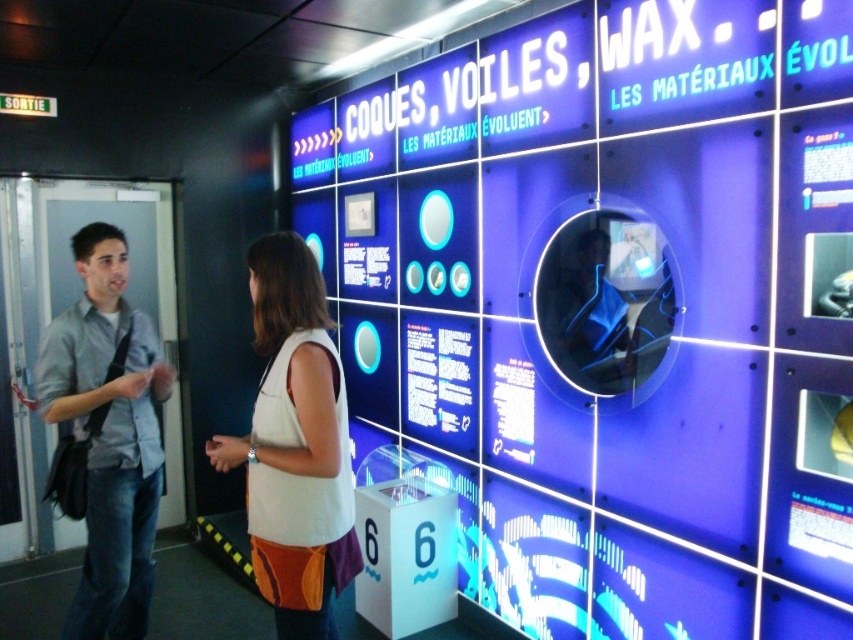
You are standing in front of the exhibit and see the white fabric dress at center and the light blue shirt at left. Which clothing item is positioned more to the right side of the exhibit?

The white fabric dress at center is positioned more to the right side of the exhibit than the light blue shirt at left.

You are standing in front of the interactive exhibit and notice two points marked on the wall. The first point is at coordinates point (263, 552) and the second is at point (103, 392). Which point do you think is closer to you?

Point (263, 552) is closer to the viewer than point (103, 392).

You are a photographer standing at the entrance of the exhibit. You want to take a photo of the white fabric dress at center without any obstructions. Since the dress is 1.97 meters away from you, can you step forward to get a closer shot without moving the dress?

The white fabric dress at center is 1.97 meters from the camera. If you step forward, you might get closer than the dress, but since the dress is part of the exhibit, moving it is not allowed. To avoid obstruction, you can step forward up to the dress but keep a safe distance to capture it clearly without blocking the view.